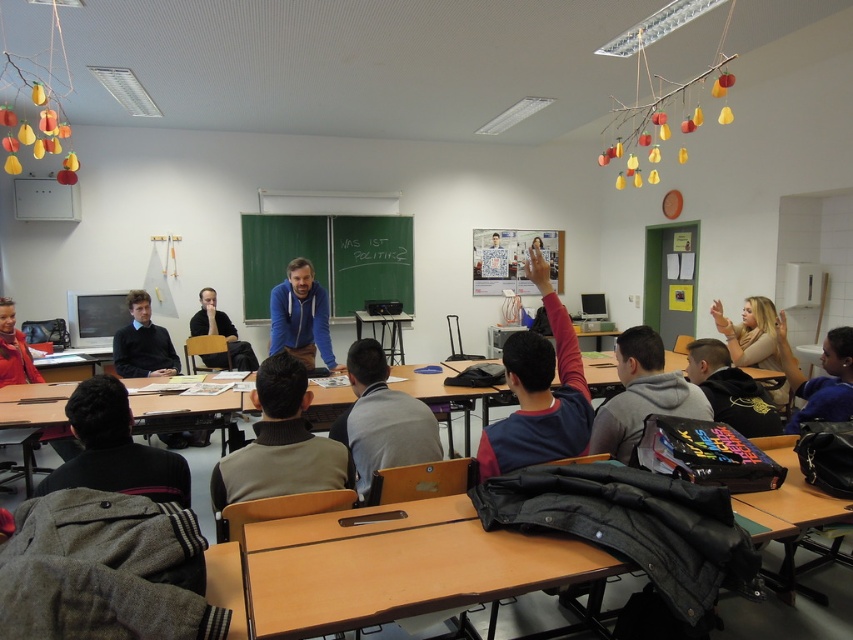
Question: Considering the real-world distances, which object is farthest from the green chalkboard at center?

Choices:
 (A) dark blue sweater at left
 (B) gray hoodie at center
 (C) dark gray hoodie at right

Answer: (B)

Question: Which object appears closest to the camera in this image?

Choices:
 (A) blue hoodie at center
 (B) green chalkboard at center
 (C) dark blue sweater at center
 (D) gray fabric jacket at center

Answer: (C)

Question: Is blue hoodie at center above dark blue sweater at left?

Choices:
 (A) no
 (B) yes

Answer: (B)

Question: Does gray fabric jacket at center lie behind dark gray hoodie at right?

Choices:
 (A) yes
 (B) no

Answer: (B)

Question: Can you confirm if light brown sweater at center is bigger than blue hoodie at center?

Choices:
 (A) no
 (B) yes

Answer: (A)

Question: Which point is closer to the camera?

Choices:
 (A) [714, 372]
 (B) [671, 412]

Answer: (B)